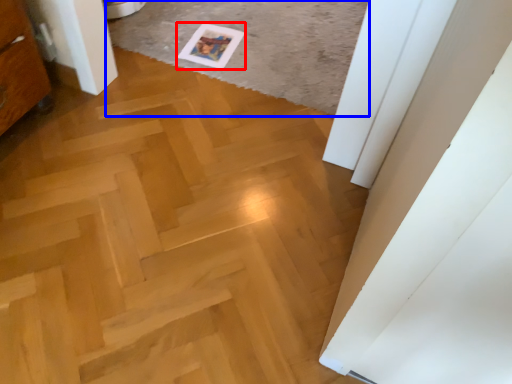
Question: Which of the following is the farthest to the observer, postcard (highlighted by a red box) or plain (highlighted by a blue box)?

Choices:
 (A) postcard
 (B) plain

Answer: (A)